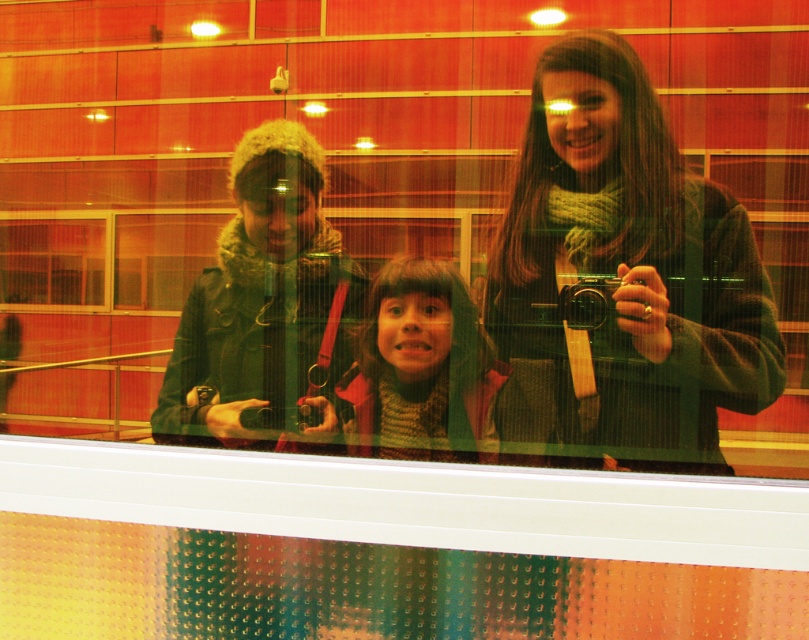
Question: Which object is positioned farthest from the matte black camera at center?

Choices:
 (A) matte green jacket at left
 (B) green knitted sweater at center
 (C) transparent glass at center

Answer: (C)

Question: Does matte green jacket at left have a larger size compared to green knitted sweater at center?

Choices:
 (A) yes
 (B) no

Answer: (A)

Question: Among these objects, which one is farthest from the camera?

Choices:
 (A) transparent glass at center
 (B) green knitted sweater at center

Answer: (A)

Question: Which object is farther from the camera taking this photo?

Choices:
 (A) transparent glass at center
 (B) matte black camera at center

Answer: (B)

Question: Does transparent glass at center have a smaller size compared to green fuzzy scarf at upper center?

Choices:
 (A) no
 (B) yes

Answer: (A)

Question: Is matte green jacket at left to the right of green knitted sweater at center from the viewer's perspective?

Choices:
 (A) no
 (B) yes

Answer: (A)